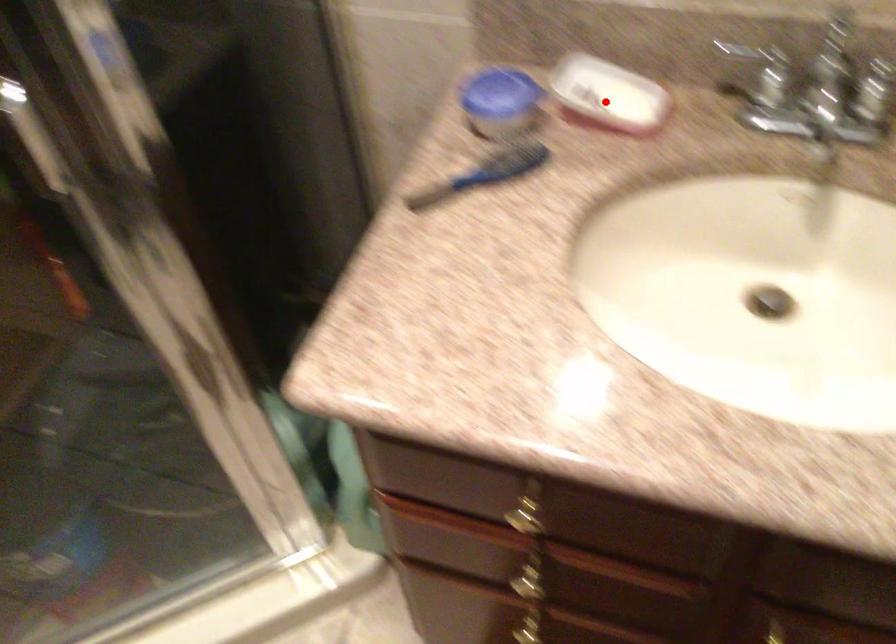
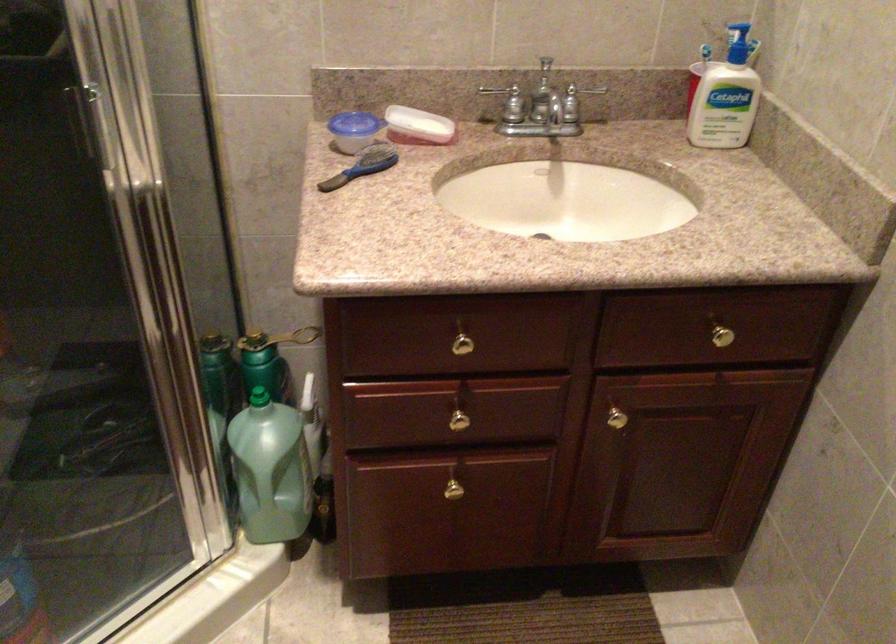
Question: I am providing you with two images of the same scene from different viewpoints. A red point is shown in image1. For the corresponding object point in image2, is it positioned nearer or farther from the camera?

Choices:
 (A) Nearer
 (B) Farther

Answer: (B)